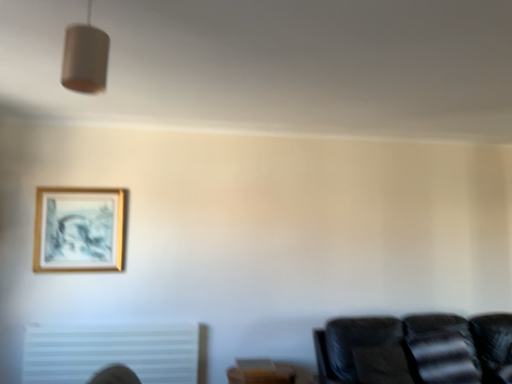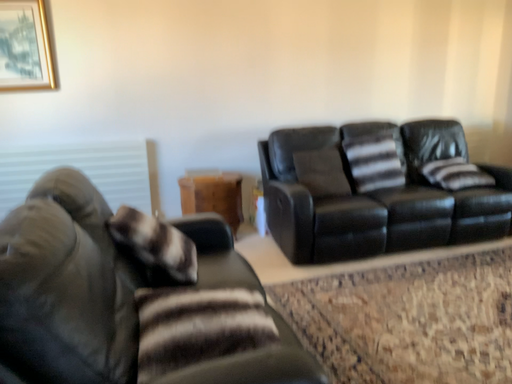
Question: Which way did the camera rotate in the video?

Choices:
 (A) rotated left
 (B) rotated right

Answer: (B)